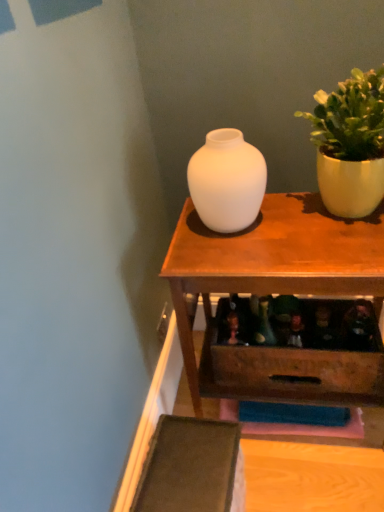
Question: Considering the relative positions of matte yellow pot at upper right and matte wood table at center in the image provided, is matte yellow pot at upper right to the left or to the right of matte wood table at center?

Choices:
 (A) right
 (B) left

Answer: (A)

Question: Is point (375, 206) closer or farther from the camera than point (258, 224)?

Choices:
 (A) farther
 (B) closer

Answer: (B)

Question: Which object is the farthest from the white matte vase at center?

Choices:
 (A) matte wood table at center
 (B) matte yellow pot at upper right

Answer: (B)

Question: Based on their relative distances, which object is farther from the matte yellow pot at upper right?

Choices:
 (A) white matte vase at center
 (B) matte wood table at center

Answer: (B)